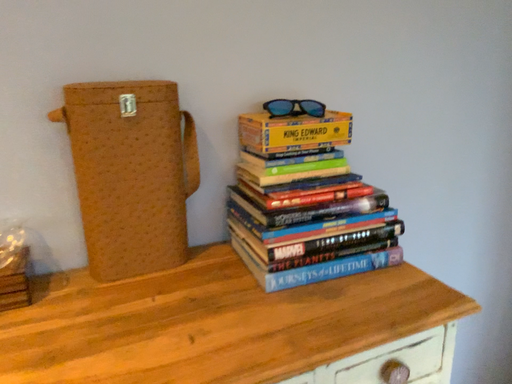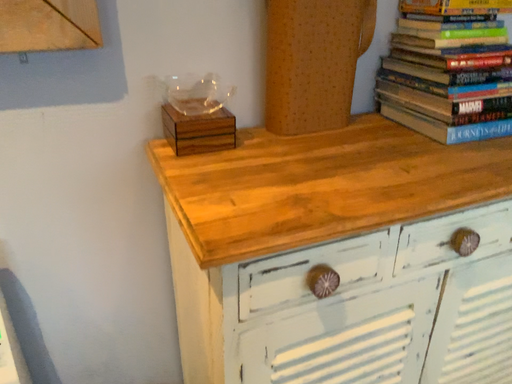
Question: How did the camera likely rotate when shooting the video?

Choices:
 (A) rotated downward
 (B) rotated upward

Answer: (A)